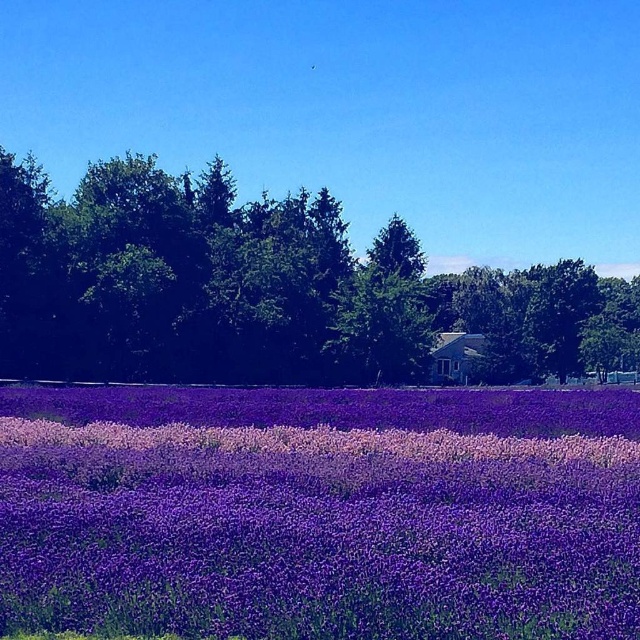
Question: Is purple soft-textured flowers at center in front of green leafy tree at center?

Choices:
 (A) yes
 (B) no

Answer: (A)

Question: Is purple soft-textured flowers at center to the right of green leafy tree at center from the viewer's perspective?

Choices:
 (A) yes
 (B) no

Answer: (B)

Question: Is purple soft-textured flowers at center smaller than green leafy tree at center?

Choices:
 (A) no
 (B) yes

Answer: (B)

Question: Which of the following is the closest to the observer?

Choices:
 (A) purple soft-textured flowers at center
 (B) green leafy tree at center

Answer: (A)